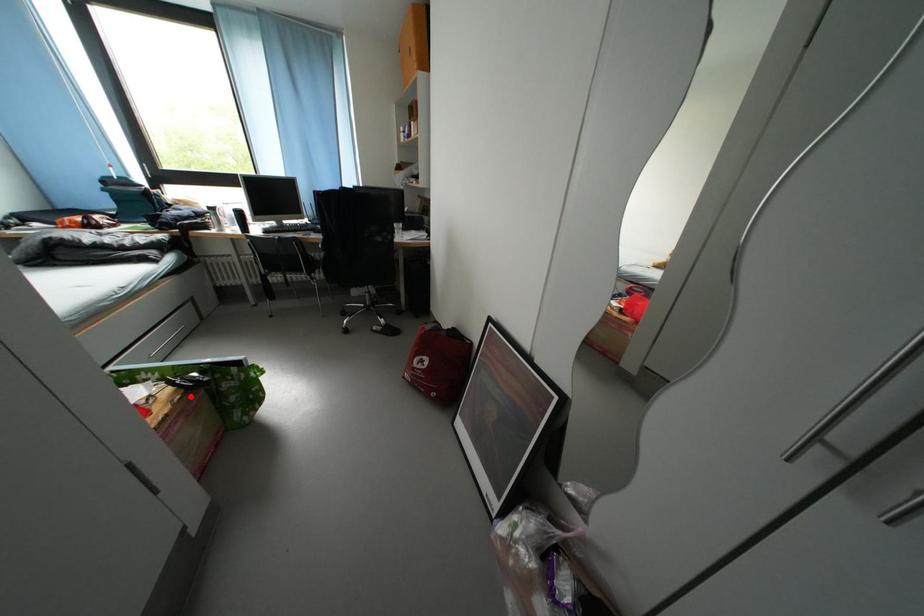
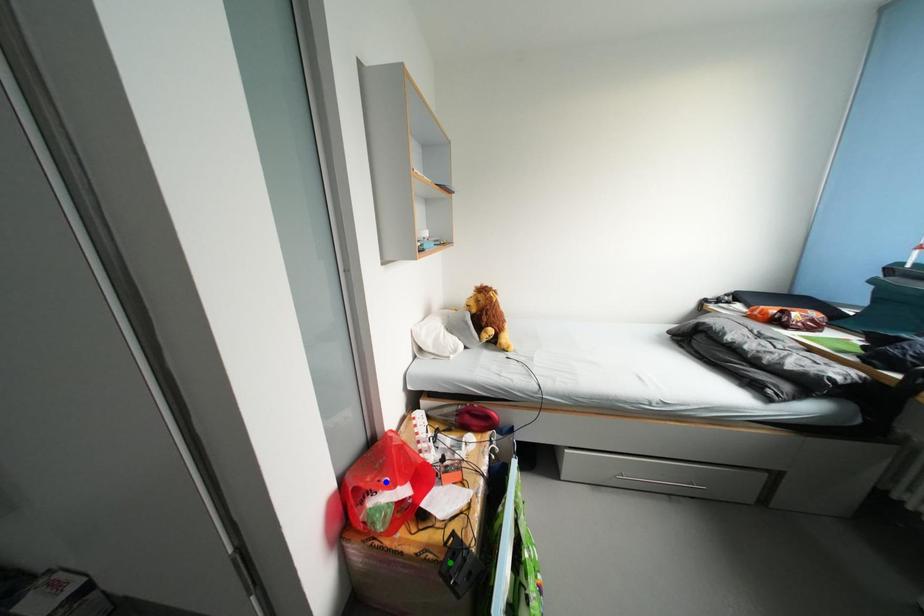
Question: I am providing you with two images of the same scene from different viewpoints. A red point is marked on the first image. You are given multiple points on the second image. Which spot in image 2 lines up with the point in image 1?

Choices:
 (A) yellow point
 (B) blue point
 (C) green point

Answer: (C)